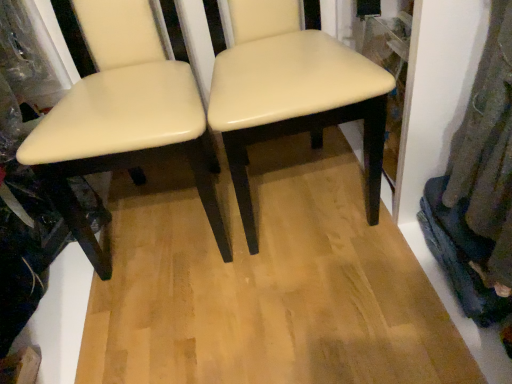
Question: From a real-world perspective, relative to matte cream chair at center, placed as the 2th chair when sorted from right to left, is cream matte chair at center, the second chair when ordered from left to right, vertically above or below?

Choices:
 (A) below
 (B) above

Answer: (A)

Question: In the image, is cream matte chair at center, the 1th chair when ordered from right to left, positioned in front of or behind matte cream chair at center, placed as the 2th chair when sorted from right to left?

Choices:
 (A) behind
 (B) front

Answer: (A)

Question: Is point click(238, 87) positioned closer to the camera than point click(94, 76)?

Choices:
 (A) farther
 (B) closer

Answer: (B)

Question: In the image, is matte cream chair at center, the 1th chair in the left-to-right sequence, on the left side or the right side of cream matte chair at center, the second chair when ordered from left to right?

Choices:
 (A) left
 (B) right

Answer: (A)

Question: Is point (105, 26) closer or farther from the camera than point (261, 94)?

Choices:
 (A) closer
 (B) farther

Answer: (B)

Question: From the image's perspective, relative to cream matte chair at center, the 1th chair when ordered from right to left, is matte cream chair at center, placed as the 2th chair when sorted from right to left, above or below?

Choices:
 (A) below
 (B) above

Answer: (A)

Question: Is matte cream chair at center, placed as the 2th chair when sorted from right to left, in front of or behind cream matte chair at center, the second chair when ordered from left to right, in the image?

Choices:
 (A) behind
 (B) front

Answer: (B)